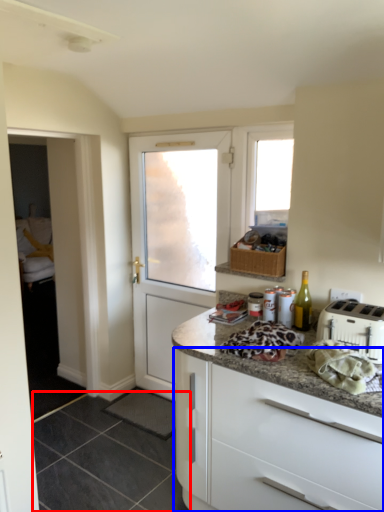
Question: Among these objects, which one is farthest to the camera, tile (highlighted by a red box) or cabinetry (highlighted by a blue box)?

Choices:
 (A) tile
 (B) cabinetry

Answer: (A)